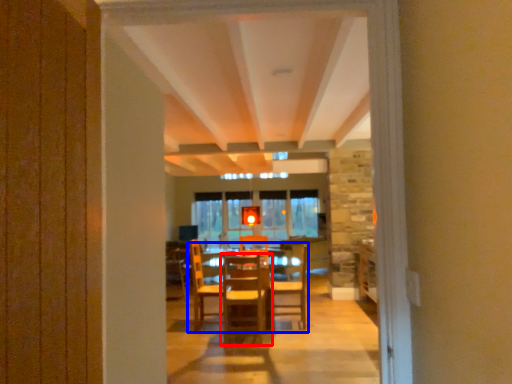
Question: Which point is closer to the camera, chair (highlighted by a red box) or table (highlighted by a blue box)?

Choices:
 (A) chair
 (B) table

Answer: (A)